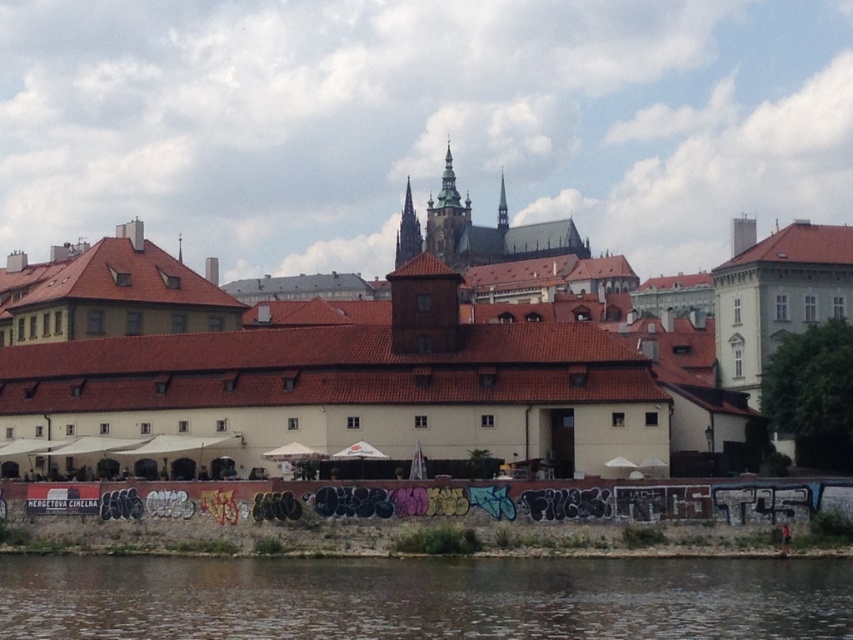
You are a photographer planning to capture the brown water at lower center and the concrete wall with graffiti at lower center in the same frame. Which object should you focus on first if you want to ensure both are in sharp focus?

You should focus on the concrete wall with graffiti at lower center first because it is smaller than the brown water at lower center, allowing for a greater depth of field to include both objects clearly.